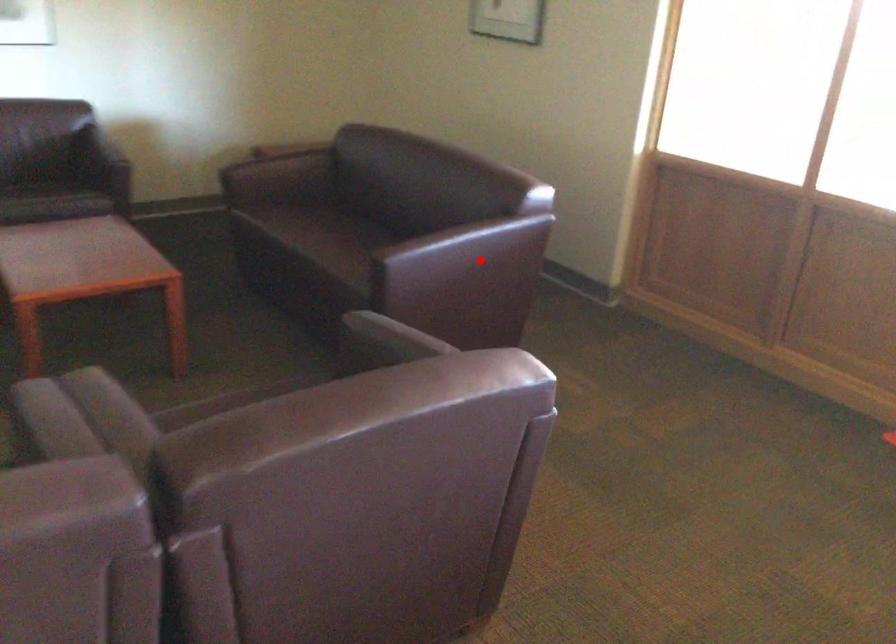
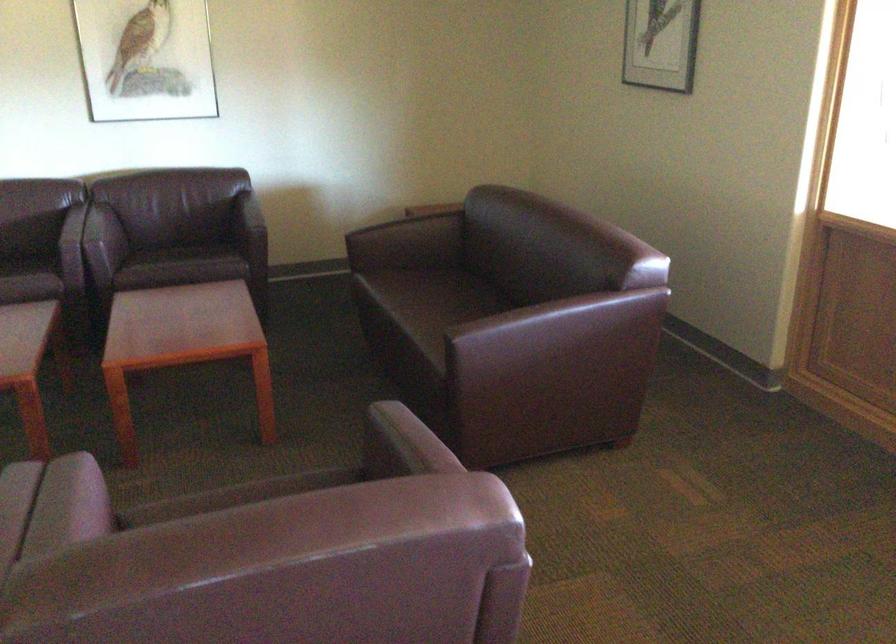
Question: I am providing you with two images of the same scene from different viewpoints. Image1 has a red point marked. In image2, the corresponding 3D location appears at what relative position? Reply with the corresponding letter.

Choices:
 (A) Closer
 (B) Farther

Answer: (A)